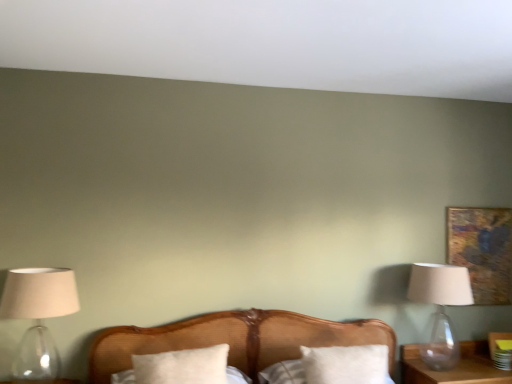
Question: Considering the relative sizes of white soft pillow at center, the second pillow positioned from the left, and white soft pillow at center, which appears as the 2th pillow when viewed from the right, in the image provided, is white soft pillow at center, the second pillow positioned from the left, shorter than white soft pillow at center, which appears as the 2th pillow when viewed from the right,?

Choices:
 (A) no
 (B) yes

Answer: (A)

Question: Can you confirm if white soft pillow at center, the second pillow positioned from the left, is positioned to the right of white soft pillow at center, which appears as the 2th pillow when viewed from the right?

Choices:
 (A) yes
 (B) no

Answer: (A)

Question: Could you tell me if white soft pillow at center, the 1th pillow viewed from the right, is facing white soft pillow at center, which appears as the 2th pillow when viewed from the right?

Choices:
 (A) no
 (B) yes

Answer: (A)

Question: From the image's perspective, does white soft pillow at center, the second pillow positioned from the left, appear higher than white soft pillow at center, which appears as the 2th pillow when viewed from the right?

Choices:
 (A) yes
 (B) no

Answer: (B)

Question: Considering the relative positions of white soft pillow at center, the second pillow positioned from the left, and white soft pillow at center, which appears as the 2th pillow when viewed from the right, in the image provided, is white soft pillow at center, the second pillow positioned from the left, behind white soft pillow at center, which appears as the 2th pillow when viewed from the right,?

Choices:
 (A) yes
 (B) no

Answer: (A)

Question: Considering the relative sizes of white soft pillow at center, the second pillow positioned from the left, and white soft pillow at center, which is the first pillow in left-to-right order, in the image provided, is white soft pillow at center, the second pillow positioned from the left, smaller than white soft pillow at center, which is the first pillow in left-to-right order,?

Choices:
 (A) no
 (B) yes

Answer: (A)

Question: Are transparent glass lamp at right, acting as the 1th lamp starting from the back, and translucent glass lampshade at left, which is counted as the first lamp, starting from the left, making contact?

Choices:
 (A) yes
 (B) no

Answer: (B)

Question: From a real-world perspective, is transparent glass lamp at right, the 2th lamp in the front-to-back sequence, below translucent glass lampshade at left, the 1th lamp positioned from the front?

Choices:
 (A) no
 (B) yes

Answer: (B)

Question: Is translucent glass lampshade at left, the second lamp viewed from the right, inside transparent glass lamp at right, the 2th lamp in the front-to-back sequence?

Choices:
 (A) no
 (B) yes

Answer: (A)

Question: Considering the relative sizes of transparent glass lamp at right, which is counted as the 1th lamp, starting from the right, and translucent glass lampshade at left, the 2th lamp positioned from the back, in the image provided, is transparent glass lamp at right, which is counted as the 1th lamp, starting from the right, wider than translucent glass lampshade at left, the 2th lamp positioned from the back,?

Choices:
 (A) yes
 (B) no

Answer: (A)

Question: Does transparent glass lamp at right, which is counted as the 1th lamp, starting from the right, appear on the left side of translucent glass lampshade at left, the 1th lamp positioned from the front?

Choices:
 (A) no
 (B) yes

Answer: (A)

Question: Can we say transparent glass lamp at right, the 2th lamp in the front-to-back sequence, lies outside translucent glass lampshade at left, the second lamp viewed from the right?

Choices:
 (A) yes
 (B) no

Answer: (A)

Question: Considering the relative sizes of white soft pillow at center, the second pillow positioned from the left, and gold textured painting at upper right in the image provided, is white soft pillow at center, the second pillow positioned from the left, thinner than gold textured painting at upper right?

Choices:
 (A) no
 (B) yes

Answer: (A)